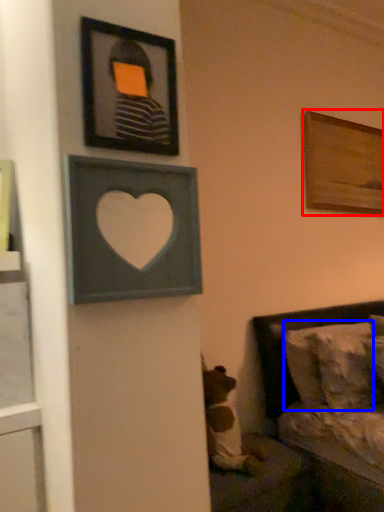
Question: Which of the following is the farthest to the observer, picture frame (highlighted by a red box) or pillow (highlighted by a blue box)?

Choices:
 (A) picture frame
 (B) pillow

Answer: (A)